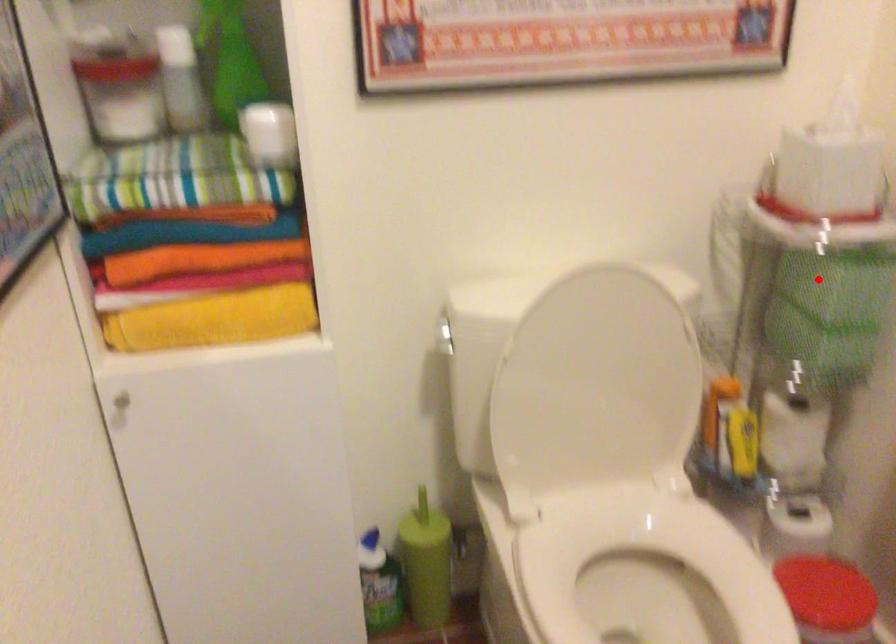
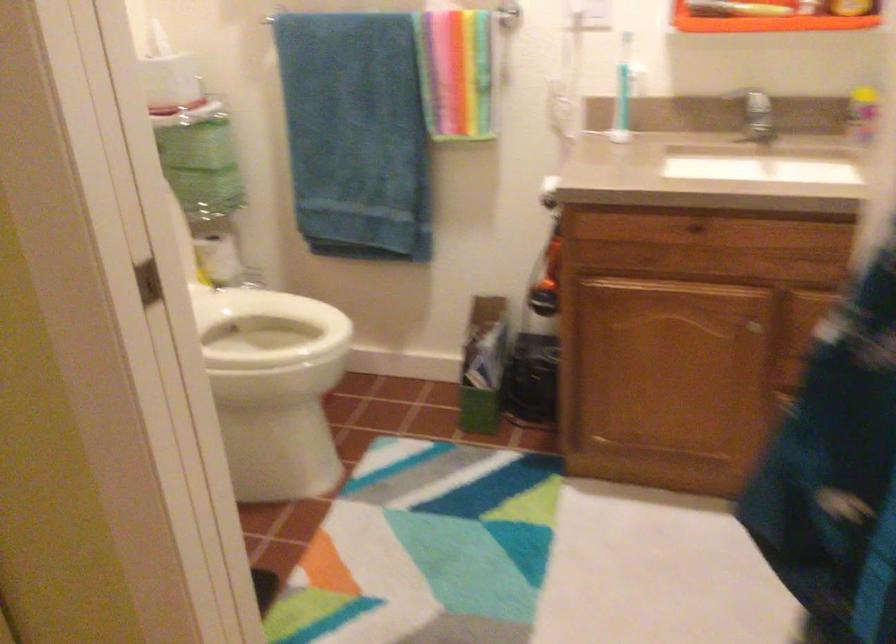
Find the pixel in the second image that matches the highlighted location in the first image.

(196, 145)